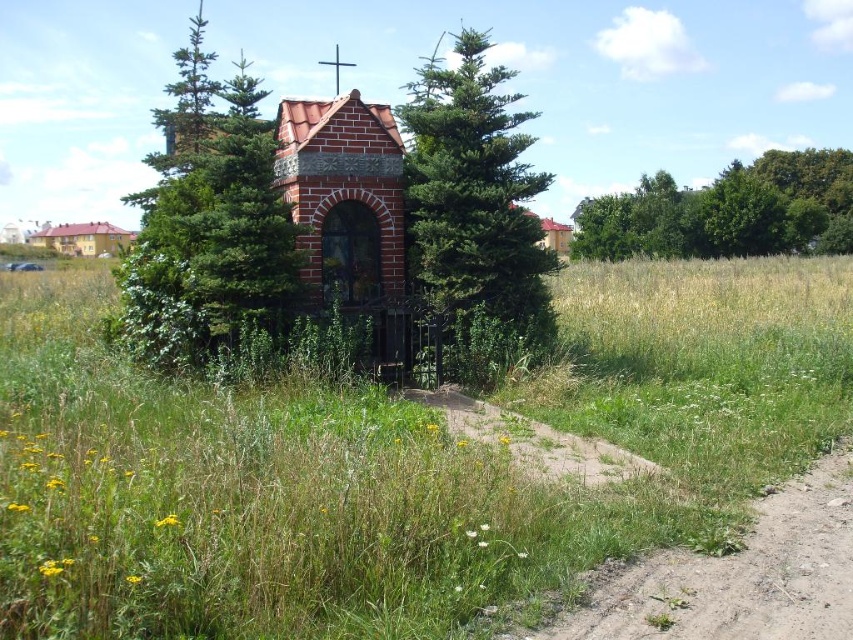
Can you confirm if green coniferous tree at center is positioned above brown sandy dirt track at lower right?

Yes.

Between green coniferous tree at center and brown sandy dirt track at lower right, which one has less height?

brown sandy dirt track at lower right

Locate an element on the screen. This screenshot has height=640, width=853. green coniferous tree at center is located at coordinates (476, 209).

Is green leafy tree at center taller than brown brick church at upper left?

Yes, green leafy tree at center is taller than brown brick church at upper left.

Between point (252, 164) and point (103, 232), which one is positioned in front?

Point (252, 164)

Who is more distant from viewer, (248, 232) or (119, 241)?

Point (119, 241)

Identify the location of green leafy tree at center. The image size is (853, 640). pos(207,224).

Who is shorter, green grassy at center or green coniferous tree at center?

green grassy at center

Which is behind, point (189, 566) or point (543, 177)?

Positioned behind is point (543, 177).

Identify the location of green grassy at center. The height and width of the screenshot is (640, 853). 393,460.